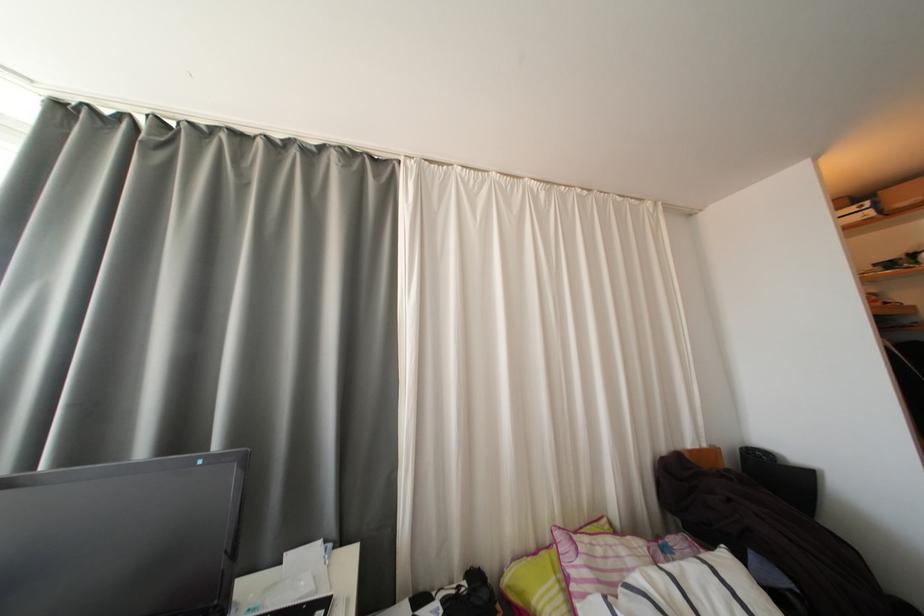
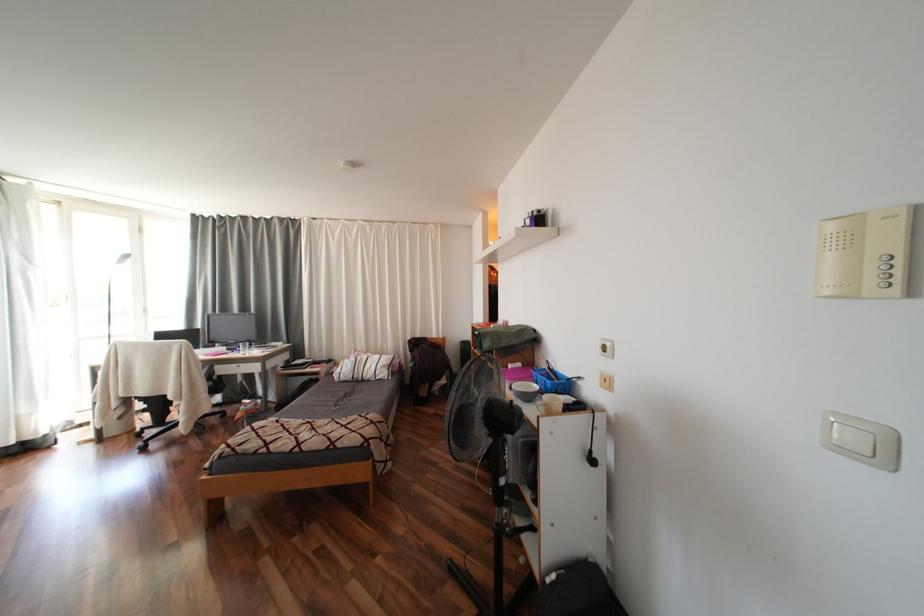
In a continuous first-person perspective shot, in which direction is the camera moving?

The cameraman walked toward right, backward.